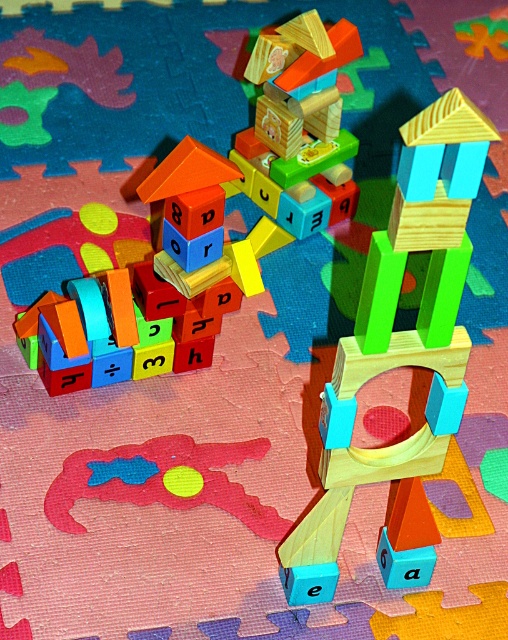
Describe the element at coordinates (398, 333) in the screenshot. Image resolution: width=508 pixels, height=640 pixels. I see `wooden tower at center` at that location.

Can you confirm if wooden tower at center is wider than wooden toy at center?

No, wooden tower at center is not wider than wooden toy at center.

Who is more forward, (394,243) or (278,29)?

Point (394,243)

The height and width of the screenshot is (640, 508). Find the location of `wooden tower at center`. wooden tower at center is located at coordinates (398, 333).

Which of these two, wooden toy at center or rubber duck at center, stands taller?

wooden toy at center is taller.

Which of these two, wooden toy at center or rubber duck at center, stands shorter?

rubber duck at center is shorter.

Between point (304, 97) and point (186, 460), which one is positioned in front?

Point (186, 460) is more forward.

Find the location of a particular element. wooden toy at center is located at coordinates (300, 125).

Is wooden blocks at center to the right of rubber duck at center from the viewer's perspective?

Incorrect, wooden blocks at center is not on the right side of rubber duck at center.

Is wooden blocks at center behind rubber duck at center?

No, it is in front of rubber duck at center.

Who is more forward, (161, 371) or (271, 531)?

Positioned in front is point (271, 531).

Locate an element on the screen. wooden blocks at center is located at coordinates (102, 336).